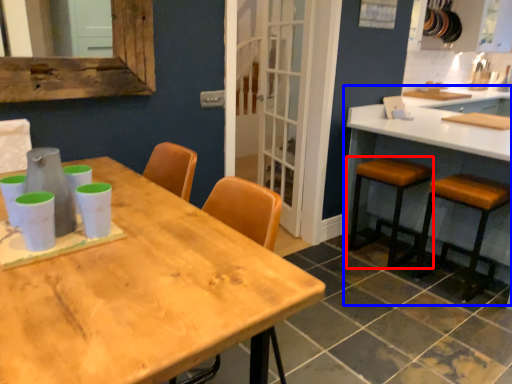
Question: Among these objects, which one is farthest to the camera, stool (highlighted by a red box) or counter (highlighted by a blue box)?

Choices:
 (A) stool
 (B) counter

Answer: (A)